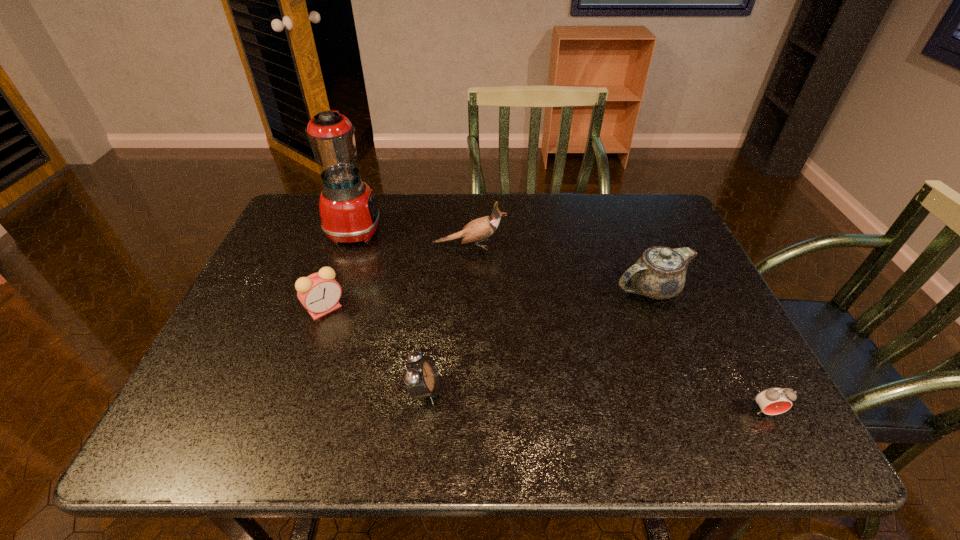
Where is `alarm clock that is the second closest to the leftmost alarm clock`? Image resolution: width=960 pixels, height=540 pixels. alarm clock that is the second closest to the leftmost alarm clock is located at coordinates (772, 401).